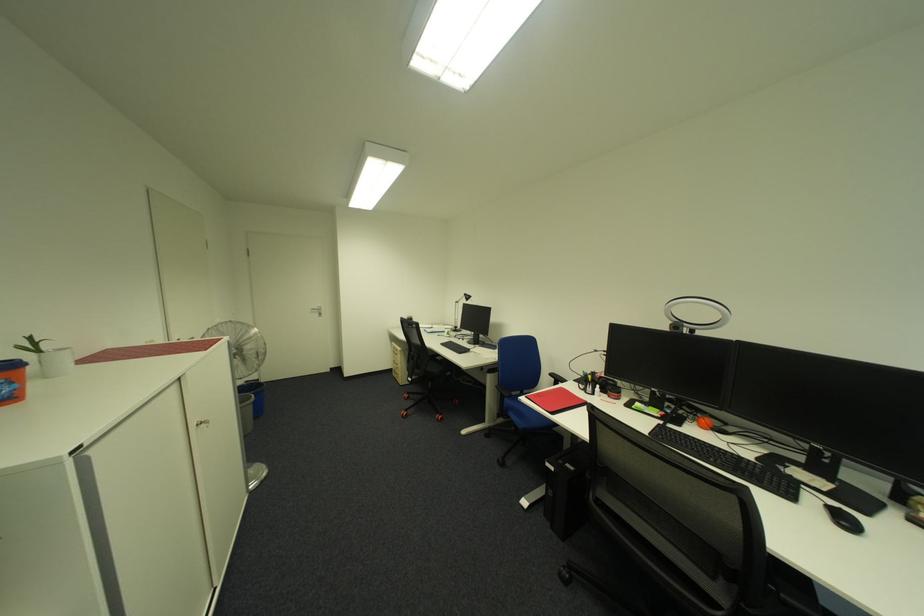
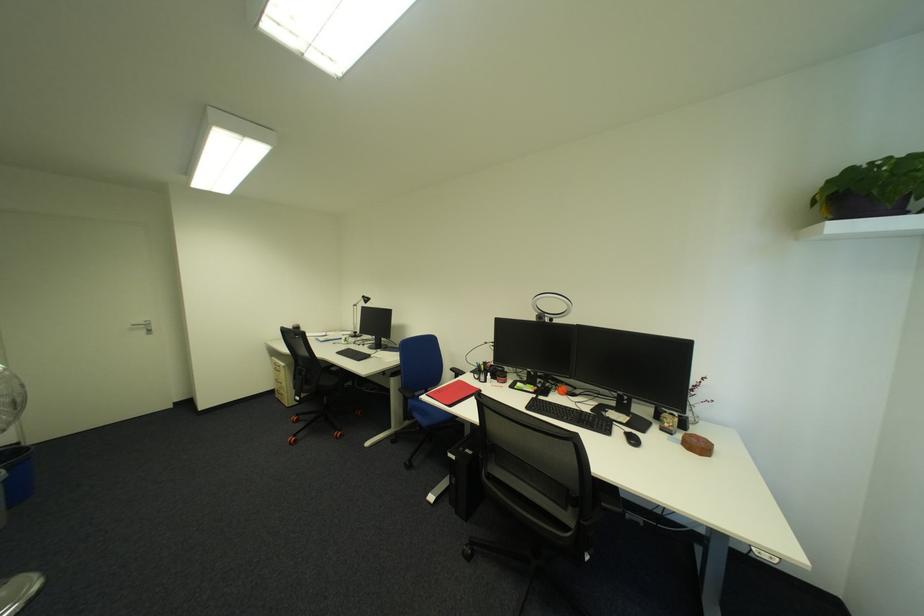
Find the pixel in the second image that matches point 724,462 in the first image.

(577, 419)